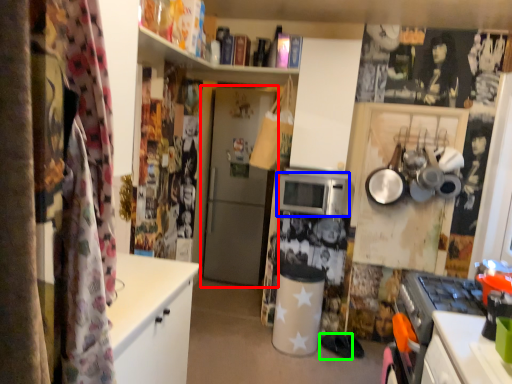
Question: Estimate the real-world distances between objects in this image. Which object is farther from door (highlighted by a red box), microwave oven (highlighted by a blue box) or footwear (highlighted by a green box)?

Choices:
 (A) microwave oven
 (B) footwear

Answer: (B)